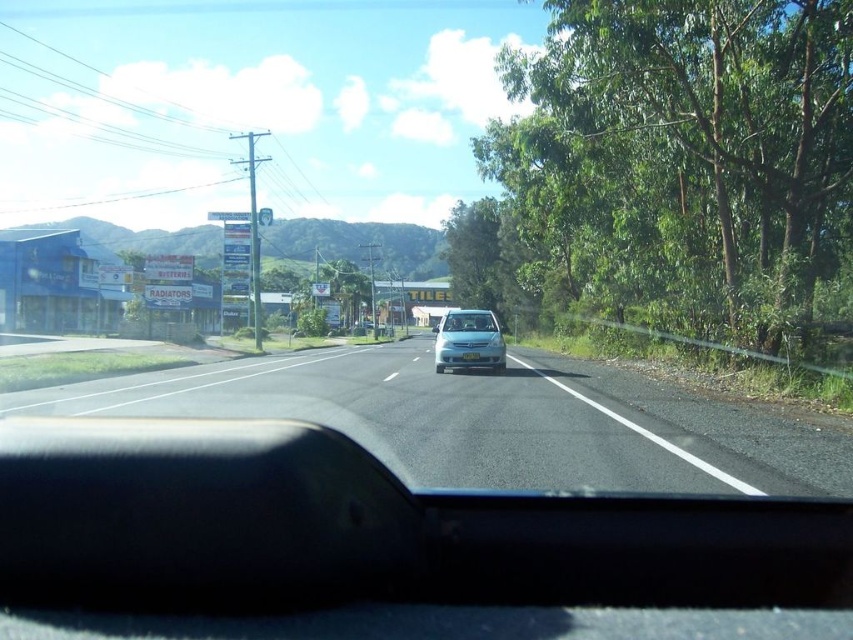
Question: Which point is closer to the camera?

Choices:
 (A) (747, 326)
 (B) (490, 314)
 (C) (587, 448)
 (D) (437, 337)

Answer: (C)

Question: Is green leafy tree at right smaller than satin silver sedan at center?

Choices:
 (A) no
 (B) yes

Answer: (A)

Question: Does satin silver sedan at center lie behind clear glass windshield at center?

Choices:
 (A) yes
 (B) no

Answer: (B)

Question: Among these objects, which one is nearest to the camera?

Choices:
 (A) asphalt road at center
 (B) clear glass windshield at center

Answer: (A)

Question: Is asphalt road at center in front of clear glass windshield at center?

Choices:
 (A) yes
 (B) no

Answer: (A)

Question: Estimate the real-world distances between objects in this image. Which object is closer to the asphalt road at center?

Choices:
 (A) green leafy tree at right
 (B) clear glass windshield at center

Answer: (B)